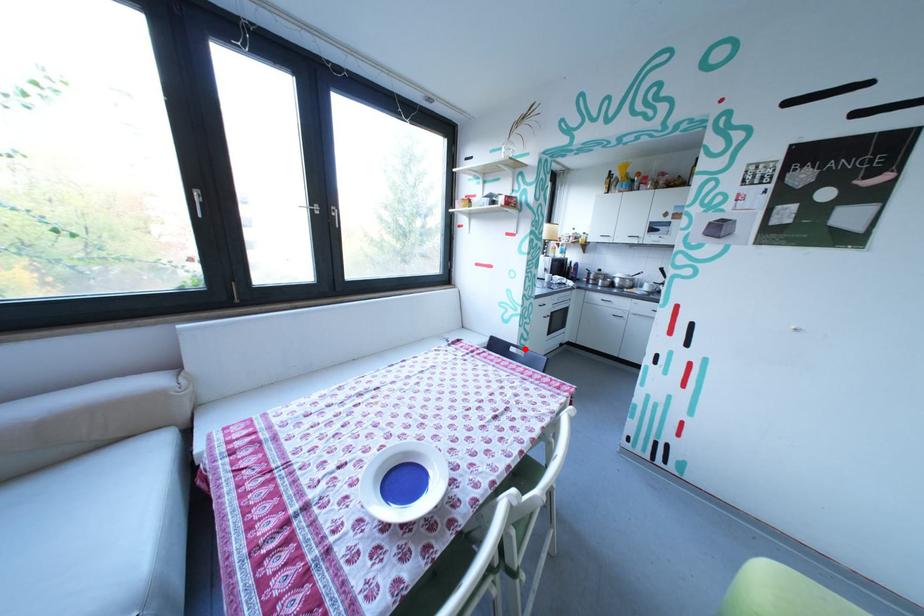
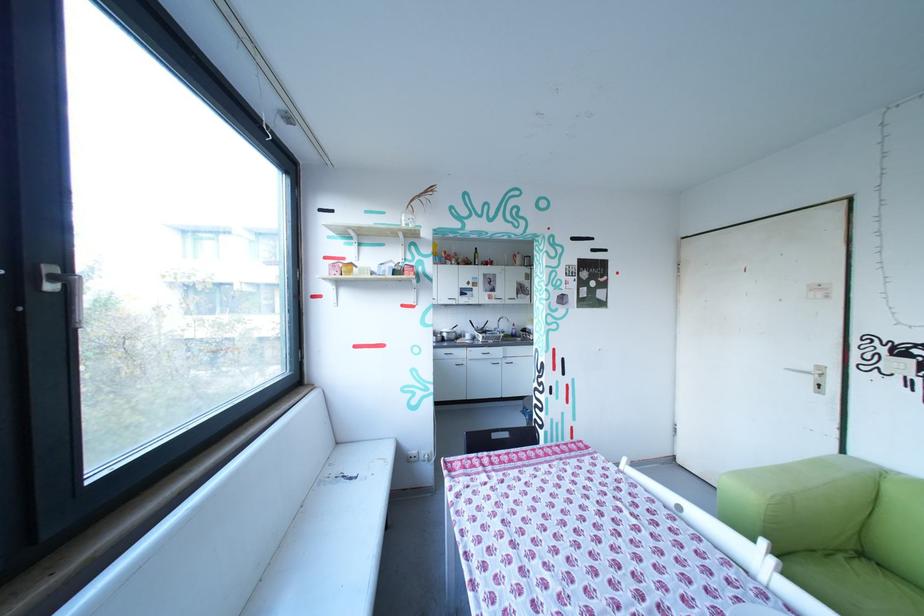
Locate, in the second image, the point that corresponds to the highlighted location in the first image.

(507, 436)